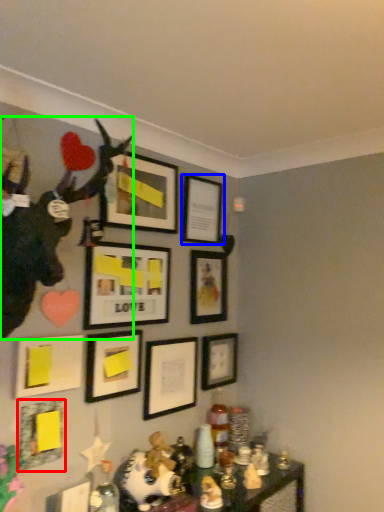
Question: Estimate the real-world distances between objects in this image. Which object is farther from picture frame (highlighted by a red box), picture frame (highlighted by a blue box) or animal (highlighted by a green box)?

Choices:
 (A) picture frame
 (B) animal

Answer: (A)